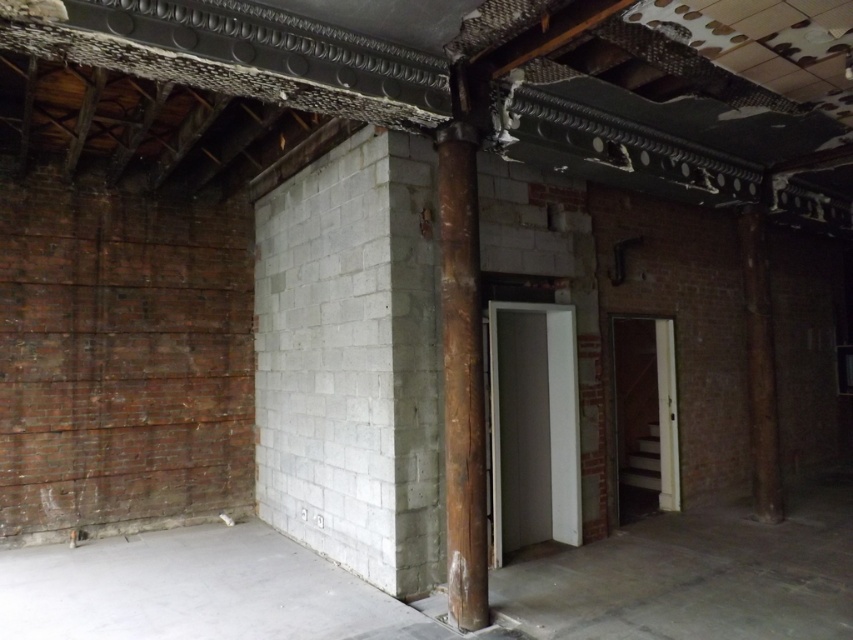
You are an inspector checking the structural integrity of the pillars in this room. You notice two pillars, the rusty wood pillar at center and the brown wood pillar at right. Which pillar is positioned to the left when viewed from the entrance?

The rusty wood pillar at center is positioned to the left of the brown wood pillar at right, so the rusty wood pillar at center is the one on the left.

You are a construction worker carrying a 4 meter long wooden beam. You need to place it between the rusty wood pillar at center and the brown wood pillar at right. Can the beam fit between them without bending?

The distance between the rusty wood pillar at center and the brown wood pillar at right is 4.12 meters. Since the beam is 4 meters long, it can fit between them without bending as there is enough space.